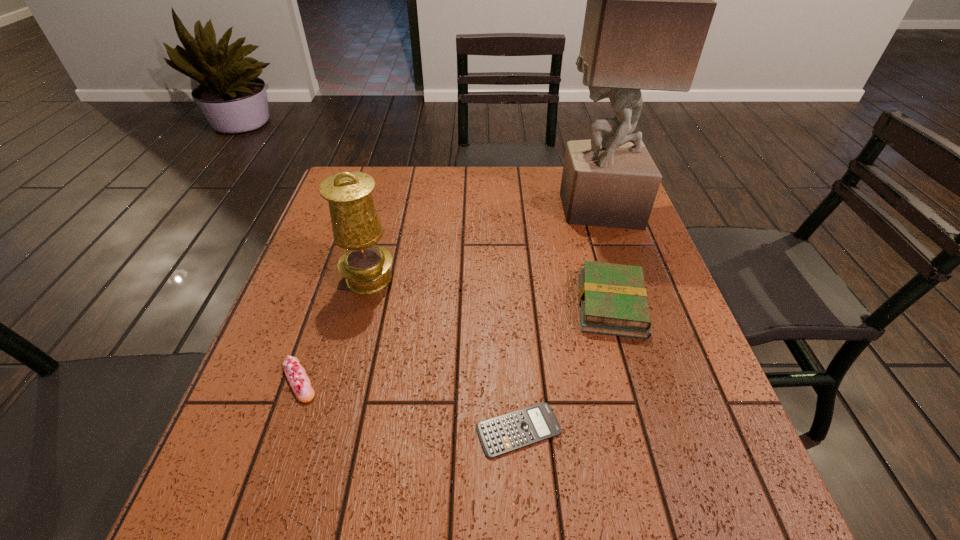
Identify the location of vacant area at the far edge of the desktop. (421, 180).

The height and width of the screenshot is (540, 960). I want to click on free region at the near edge of the desktop, so click(549, 484).

Where is `blank area at the left edge`? blank area at the left edge is located at coordinates (280, 437).

This screenshot has height=540, width=960. What are the coordinates of `vacant area at the right edge` in the screenshot? It's located at (629, 253).

At what (x,y) coordinates should I click in order to perform the action: click on vacant space in between the book and the oil lamp. Please return your answer as a coordinate pair (x, y). Looking at the image, I should click on (491, 292).

Locate an element on the screen. The width and height of the screenshot is (960, 540). unoccupied area between the third object from right to left and the oil lamp is located at coordinates (444, 354).

This screenshot has width=960, height=540. In order to click on free space between the third object from right to left and the eclair in this screenshot , I will do `click(409, 405)`.

The width and height of the screenshot is (960, 540). I want to click on vacant space in between the farthest object and the second shortest object, so click(x=448, y=294).

You are a GUI agent. You are given a task and a screenshot of the screen. Output one action in this format:
    pyautogui.click(x=<x>, y=<y>)
    Task: Click on the free space between the fourth tallest object and the fourth shortest object
    The image size is (960, 540).
    Given the screenshot: What is the action you would take?
    pyautogui.click(x=334, y=330)

This screenshot has width=960, height=540. Identify the location of vacant space that is in between the fourth shortest object and the sculpture. (483, 243).